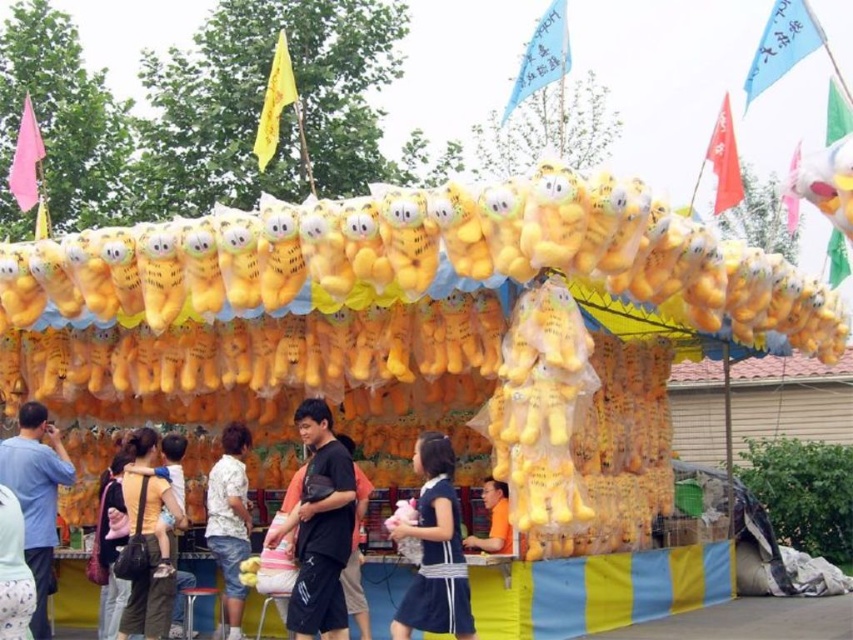
Who is positioned more to the left, dark blue cotton dress at center or blue cotton shirt at left?

Positioned to the left is blue cotton shirt at left.

Can you confirm if dark blue cotton dress at center is positioned below blue cotton shirt at left?

No, dark blue cotton dress at center is not below blue cotton shirt at left.

This screenshot has width=853, height=640. I want to click on dark blue cotton dress at center, so click(x=434, y=548).

Can you confirm if yellow plush toy at center is positioned to the left of blue cotton shirt at left?

In fact, yellow plush toy at center is to the right of blue cotton shirt at left.

Does yellow plush toy at center have a greater width compared to blue cotton shirt at left?

No, yellow plush toy at center is not wider than blue cotton shirt at left.

You are a GUI agent. You are given a task and a screenshot of the screen. Output one action in this format:
    pyautogui.click(x=<x>, y=<y>)
    Task: Click on the yellow plush toy at center
    
    Given the screenshot: What is the action you would take?
    pyautogui.click(x=418, y=259)

The image size is (853, 640). I want to click on yellow plush toy at center, so click(418, 259).

Can you confirm if black cotton shirt at center is taller than matte yellow plush toy at lower left?

Yes.

Which is behind, point (323, 524) or point (154, 580)?

Point (154, 580)

Is point (306, 419) positioned in front of point (141, 454)?

Yes.

Image resolution: width=853 pixels, height=640 pixels. I want to click on black cotton shirt at center, so (320, 528).